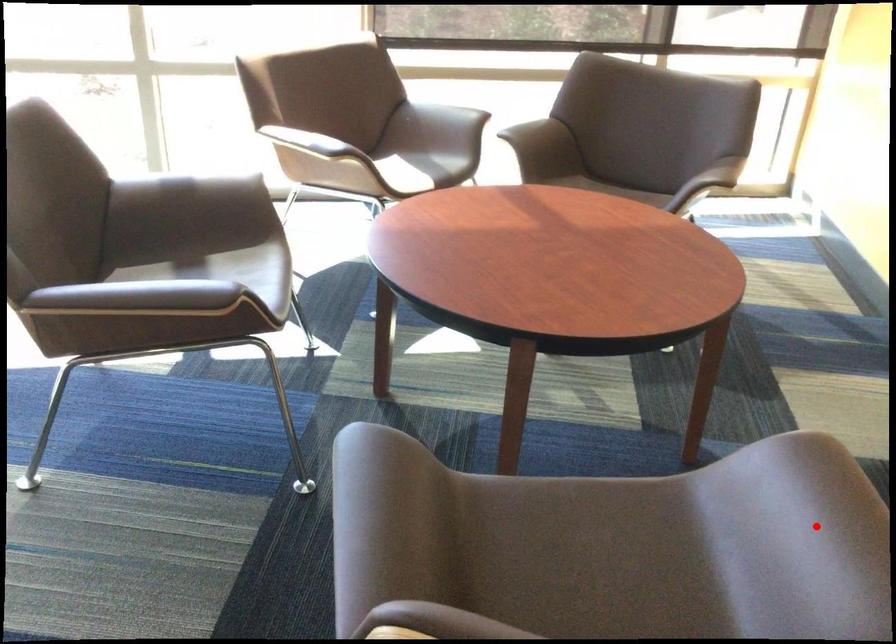
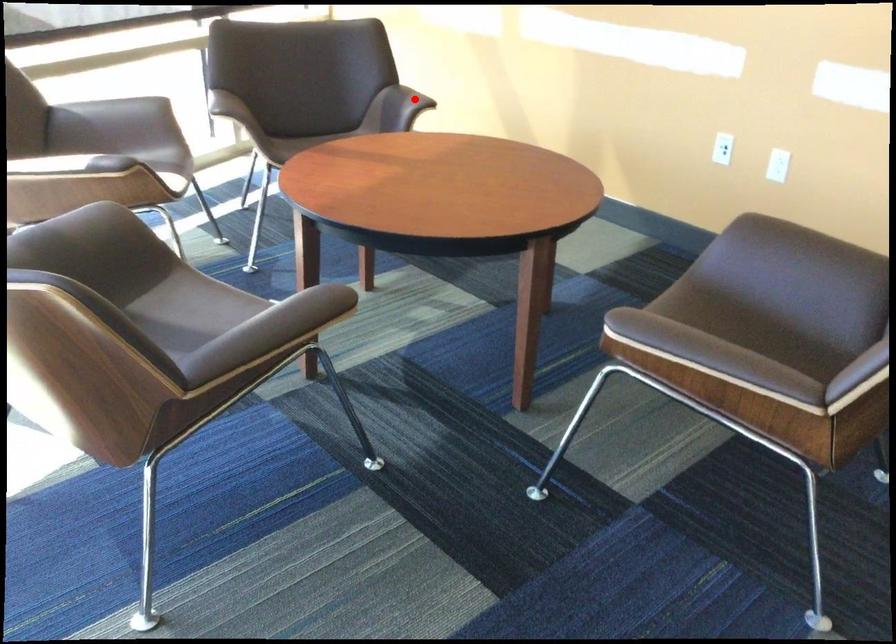
I am providing you with two images of the same scene from different viewpoints. A red point is marked on the first image and another point is marked on the second image. Are the points marked in image1 and image2 representing the same 3D position?

No